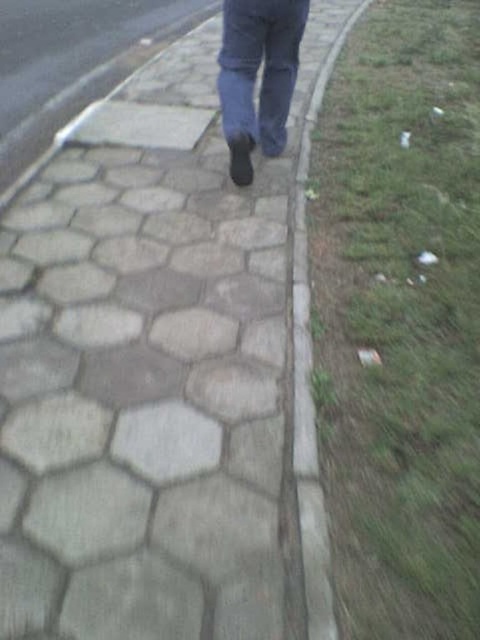
Question: Can you confirm if gray concrete curb at center is positioned to the left of denim at center?

Choices:
 (A) yes
 (B) no

Answer: (B)

Question: Does gray concrete curb at center appear over denim at center?

Choices:
 (A) no
 (B) yes

Answer: (A)

Question: Which of the following is the farthest from the observer?

Choices:
 (A) (228, 0)
 (B) (305, 349)

Answer: (A)

Question: Is gray concrete curb at center to the right of denim at center from the viewer's perspective?

Choices:
 (A) no
 (B) yes

Answer: (B)